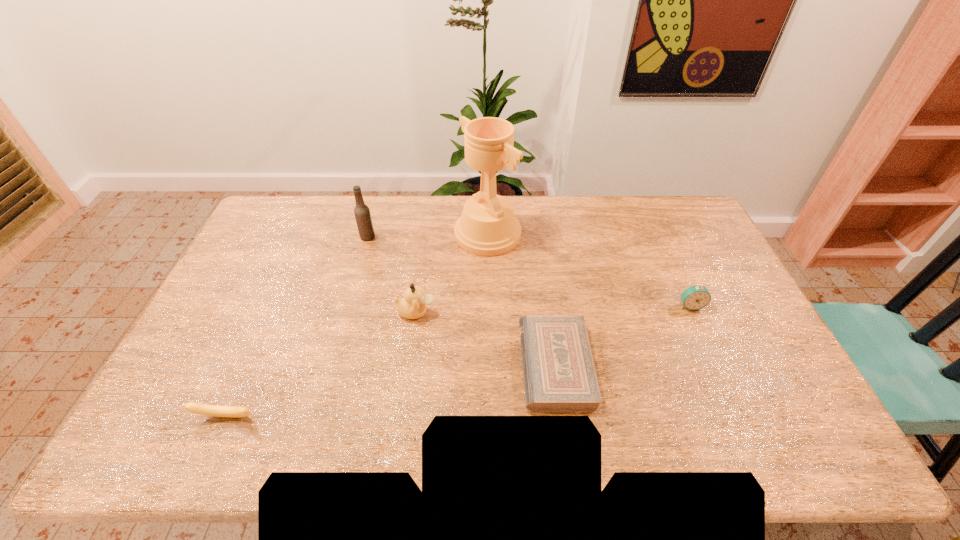
What are the coordinates of `empty location between the third tallest object and the second object from left to right` in the screenshot? It's located at (392, 274).

At what (x,y) coordinates should I click in order to perform the action: click on free area in between the Bible and the third shortest object. Please return your answer as a coordinate pair (x, y). This screenshot has height=540, width=960. Looking at the image, I should click on (623, 335).

Where is `vacant area between the tallest object and the banana`? vacant area between the tallest object and the banana is located at coordinates (357, 325).

You are a GUI agent. You are given a task and a screenshot of the screen. Output one action in this format:
    pyautogui.click(x=<x>, y=<y>)
    Task: Click on the free space between the leftmost object and the third shortest object
    This screenshot has width=960, height=540.
    Given the screenshot: What is the action you would take?
    pyautogui.click(x=458, y=361)

Where is `free space between the award and the duckling`? This screenshot has width=960, height=540. free space between the award and the duckling is located at coordinates (452, 273).

The height and width of the screenshot is (540, 960). I want to click on object that is the second closest to the beer bottle, so click(413, 306).

Identify which object is the second closest to the fifth object from right to left. Please provide its 2D coordinates. Your answer should be formatted as a tuple, i.e. [(x, y)], where the tuple contains the x and y coordinates of a point satisfying the conditions above.

[(413, 306)]

Where is `blank area in the image that satisfies the following two spatial constraints: 1. on the front-facing side of the rightmost object; 2. on the face of the fourth object from right to left`? This screenshot has height=540, width=960. blank area in the image that satisfies the following two spatial constraints: 1. on the front-facing side of the rightmost object; 2. on the face of the fourth object from right to left is located at coordinates (693, 312).